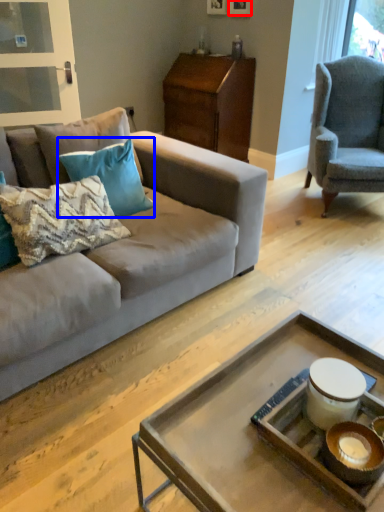
Question: Which object is further to the camera taking this photo, picture frame (highlighted by a red box) or pillow (highlighted by a blue box)?

Choices:
 (A) picture frame
 (B) pillow

Answer: (A)